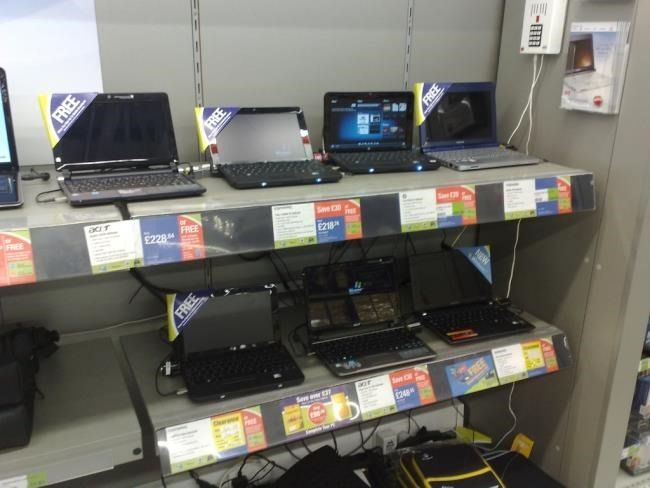
This screenshot has height=488, width=650. What are the coordinates of `laptop screen` in the screenshot? It's located at (131, 123).